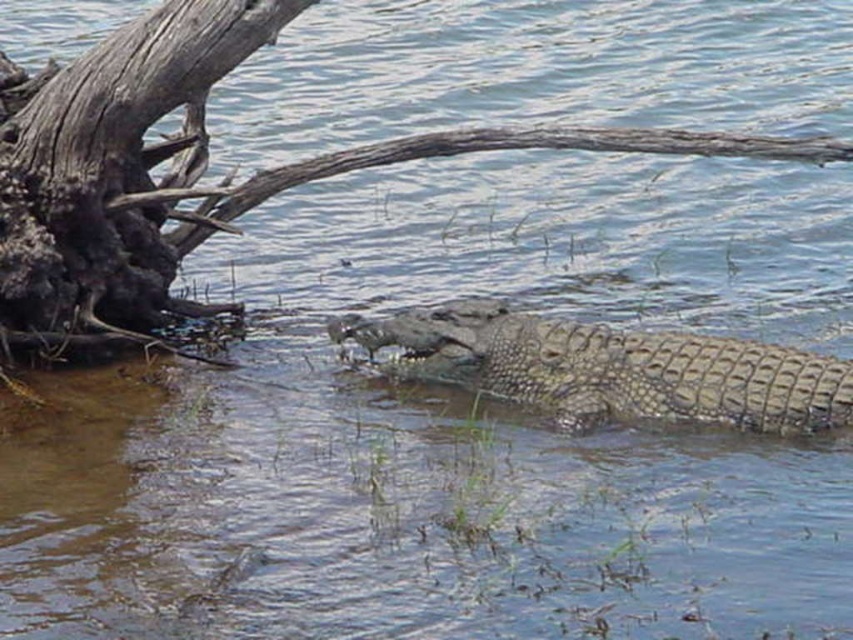
Between point (4, 248) and point (764, 138), which one is positioned behind?

The point (764, 138) is behind.

Which is more to the left, dark brown rough wood at left or gray rough wood log at upper center?

dark brown rough wood at left is more to the left.

Describe the element at coordinates (115, 177) in the screenshot. This screenshot has height=640, width=853. I see `dark brown rough wood at left` at that location.

Where is `dark brown rough wood at left`? Image resolution: width=853 pixels, height=640 pixels. dark brown rough wood at left is located at coordinates (115, 177).

Which is above, dark brown rough wood at left or textured brown crocodile at center?

dark brown rough wood at left is above.

Is point (138, 257) behind point (651, 408)?

Yes, it is.

The image size is (853, 640). What do you see at coordinates (115, 177) in the screenshot? I see `dark brown rough wood at left` at bounding box center [115, 177].

The image size is (853, 640). Find the location of `dark brown rough wood at left`. dark brown rough wood at left is located at coordinates (115, 177).

Does textured brown crocodile at center appear under gray rough wood log at upper center?

Indeed, textured brown crocodile at center is positioned under gray rough wood log at upper center.

Is textured brown crocodile at center thinner than gray rough wood log at upper center?

Yes, textured brown crocodile at center is thinner than gray rough wood log at upper center.

Is point (502, 384) more distant than point (440, 154)?

No, it is in front of (440, 154).

Locate an element on the screen. This screenshot has width=853, height=640. textured brown crocodile at center is located at coordinates (610, 369).